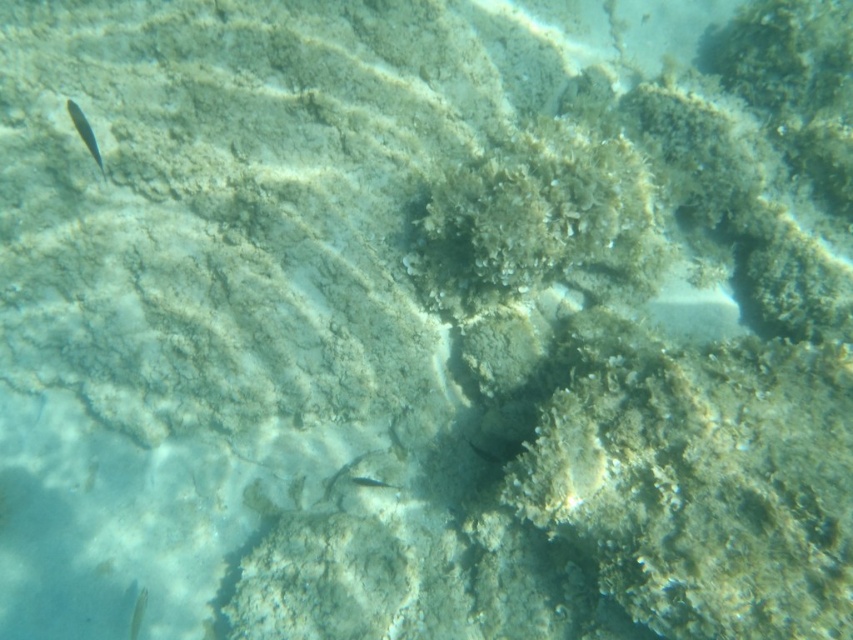
Question: Does green translucent fish at upper left have a larger size compared to translucent clear fish at lower left?

Choices:
 (A) no
 (B) yes

Answer: (B)

Question: Does green translucent fish at upper left appear on the right side of translucent clear fish at lower left?

Choices:
 (A) yes
 (B) no

Answer: (A)

Question: Does green translucent fish at upper left have a smaller size compared to translucent clear fish at lower left?

Choices:
 (A) no
 (B) yes

Answer: (A)